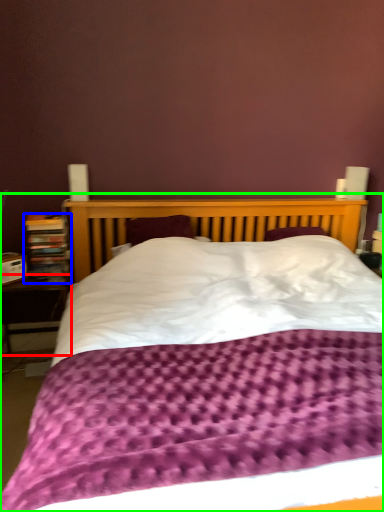
Question: Which object is positioned farthest from table (highlighted by a red box)? Select from bookcase (highlighted by a blue box) and bed (highlighted by a green box).

Choices:
 (A) bookcase
 (B) bed

Answer: (B)